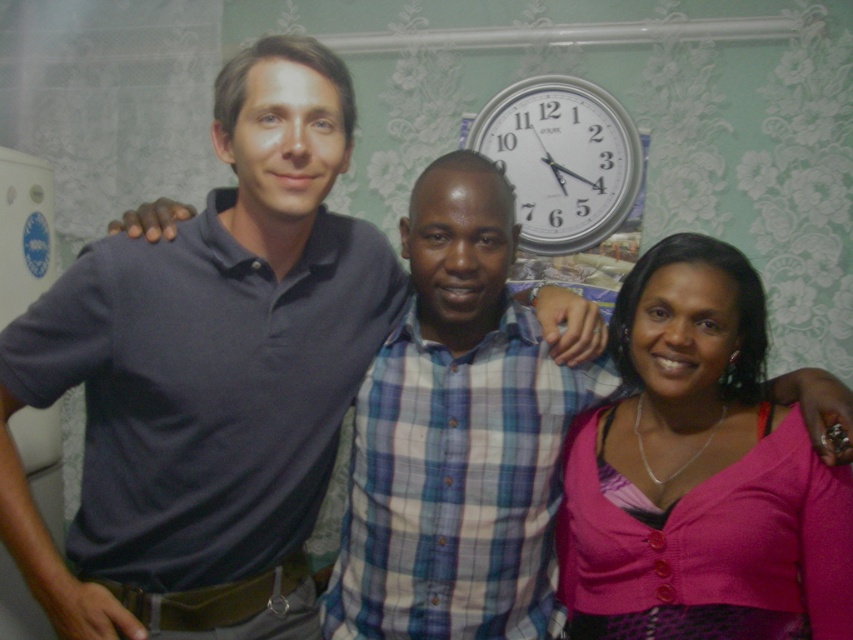
Does dark blue polo shirt at center have a lesser height compared to silver metallic clock at upper center?

Incorrect, dark blue polo shirt at center's height does not fall short of silver metallic clock at upper center's.

Between point (144, 378) and point (515, 176), which one is positioned in front?

Point (144, 378) is more forward.

At what (x,y) coordinates should I click in order to perform the action: click on dark blue polo shirt at center. Please return your answer as a coordinate pair (x, y). This screenshot has height=640, width=853. Looking at the image, I should click on (207, 376).

Is pink fabric top at center to the right of silver metallic clock at upper center from the viewer's perspective?

Indeed, pink fabric top at center is positioned on the right side of silver metallic clock at upper center.

Who is shorter, pink fabric top at center or silver metallic clock at upper center?

silver metallic clock at upper center

Is point (761, 568) closer to camera compared to point (624, 186)?

Yes.

I want to click on pink fabric top at center, so click(x=699, y=474).

Is point (300, 250) farther from camera compared to point (567, 538)?

No, (300, 250) is closer to viewer.

Between dark blue polo shirt at center and pink fabric top at center, which one has more height?

With more height is dark blue polo shirt at center.

Who is more forward, (x=329, y=410) or (x=770, y=460)?

Point (x=770, y=460) is more forward.

What are the coordinates of `dark blue polo shirt at center` in the screenshot? It's located at (207, 376).